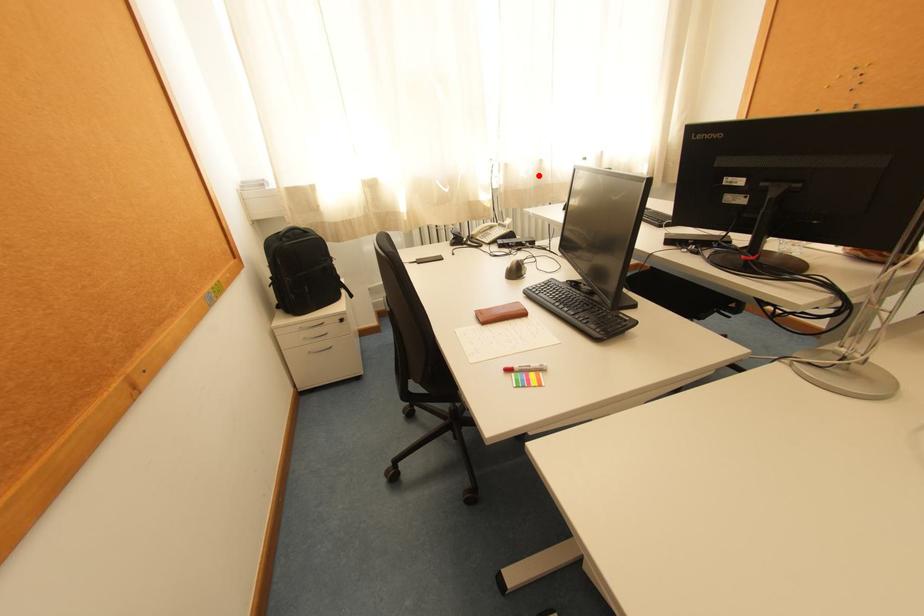
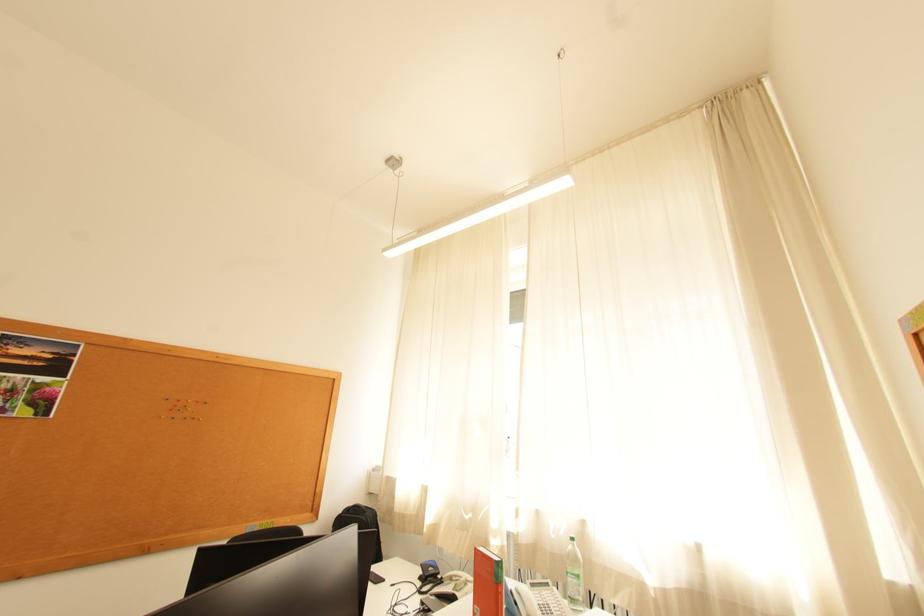
Question: I am providing you with two images of the same scene from different viewpoints. Image1 has a red point marked. In image2, the corresponding 3D location appears at what relative position? Reply with the corresponding letter.

Choices:
 (A) Closer
 (B) Farther

Answer: (B)